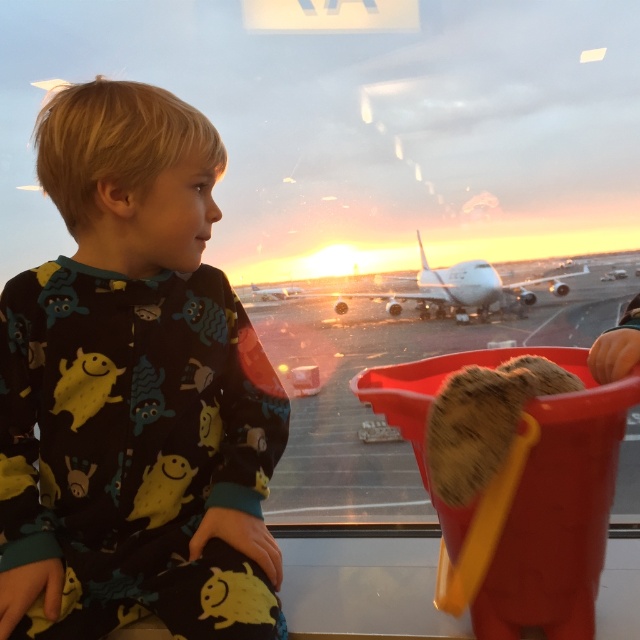
Does black cotton pajamas at center appear under white matte airplane at center?

Yes.

Which is in front, point (54, 378) or point (564, 273)?

Positioned in front is point (54, 378).

Identify the location of black cotton pajamas at center. This screenshot has height=640, width=640. (132, 392).